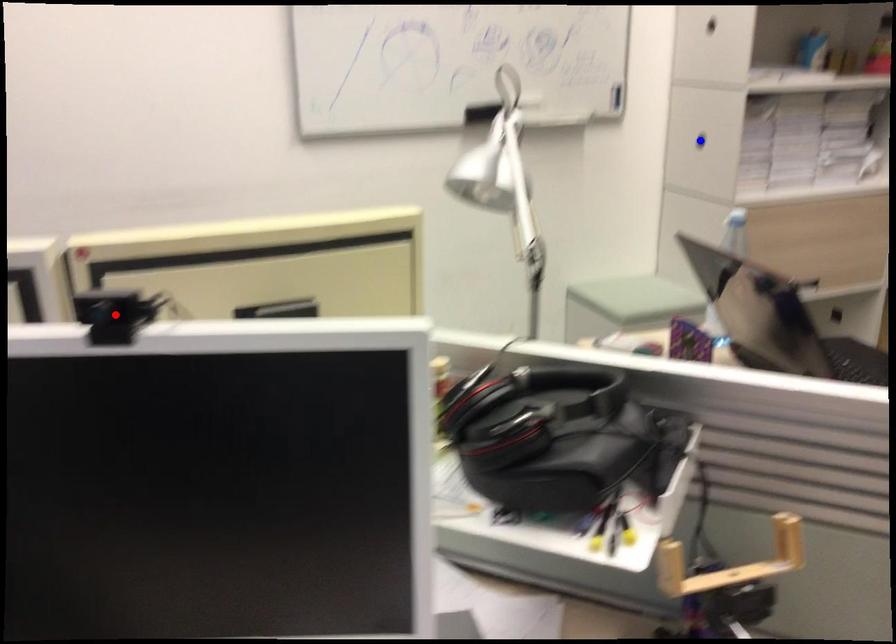
Question: In the image, two points are highlighted. Which point is nearer to the camera? Reply with the corresponding letter.

Choices:
 (A) blue point
 (B) red point

Answer: (B)